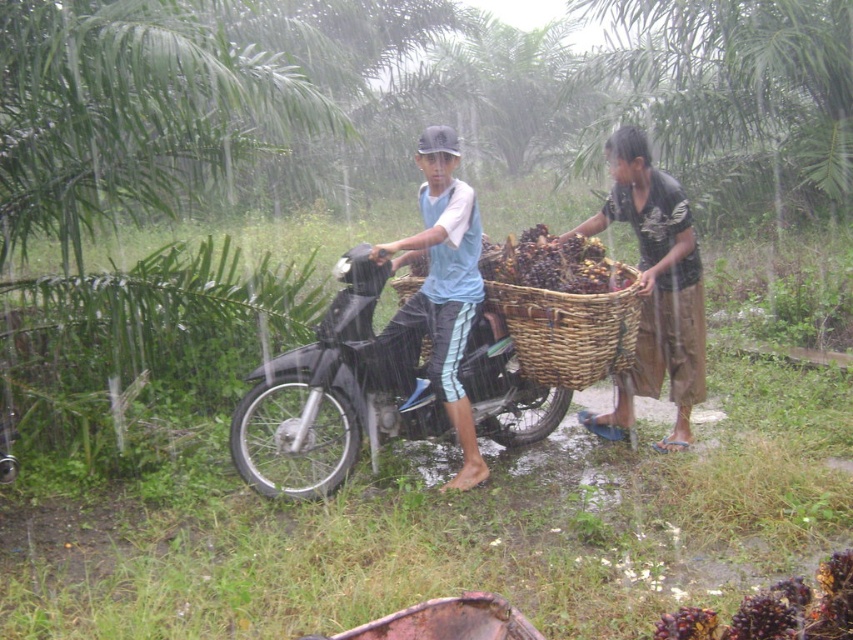
Between point (241, 464) and point (433, 332), which one is positioned in front?

Point (241, 464)

Which is more to the left, black matte motorcycle at center or light blue fabric shirt at center?

black matte motorcycle at center

Does point (228, 445) come closer to viewer compared to point (444, 128)?

No, it is not.

This screenshot has height=640, width=853. What are the coordinates of `black matte motorcycle at center` in the screenshot? It's located at (332, 392).

Which is above, brown woven basket at right or woven brown basket at center?

brown woven basket at right is higher up.

Is brown woven basket at right to the right of woven brown basket at center from the viewer's perspective?

Correct, you'll find brown woven basket at right to the right of woven brown basket at center.

Is point (646, 232) positioned before point (544, 342)?

That is False.

Image resolution: width=853 pixels, height=640 pixels. I want to click on brown woven basket at right, so click(654, 289).

Can you confirm if matte wicker basket at center is thinner than brown woven basket at right?

In fact, matte wicker basket at center might be wider than brown woven basket at right.

The height and width of the screenshot is (640, 853). What do you see at coordinates (657, 257) in the screenshot? I see `matte wicker basket at center` at bounding box center [657, 257].

At what (x,y) coordinates should I click in order to perform the action: click on matte wicker basket at center. Please return your answer as a coordinate pair (x, y). This screenshot has width=853, height=640. Looking at the image, I should click on (657, 257).